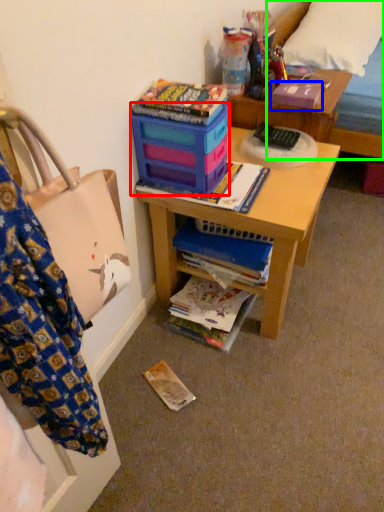
Question: Which is farther away from box (highlighted by a red box)? paperback book (highlighted by a blue box) or bed (highlighted by a green box)?

Choices:
 (A) paperback book
 (B) bed

Answer: (B)